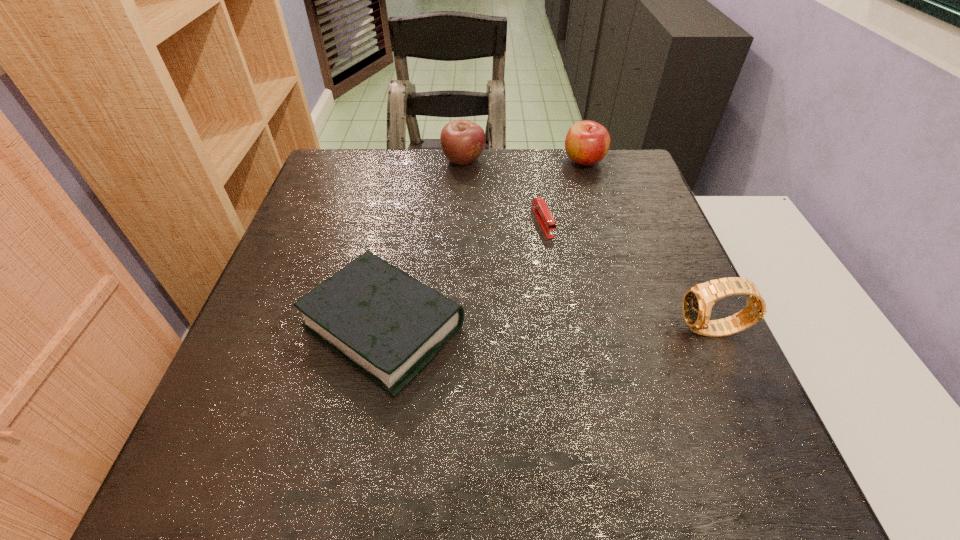
The width and height of the screenshot is (960, 540). I want to click on the third closest object to the fourth tallest object, so click(698, 300).

Choose which object is the nearest neighbor to the fourth tallest object. Please provide its 2D coordinates. Your answer should be formatted as a tuple, i.e. [(x, y)], where the tuple contains the x and y coordinates of a point satisfying the conditions above.

[(541, 211)]

Where is `free space in the image that satisfies the following two spatial constraints: 1. on the back side of the second object from right to left; 2. on the right side of the shortest object`? This screenshot has height=540, width=960. free space in the image that satisfies the following two spatial constraints: 1. on the back side of the second object from right to left; 2. on the right side of the shortest object is located at coordinates (533, 161).

I want to click on free space that satisfies the following two spatial constraints: 1. on the back side of the left apple; 2. on the right side of the second shortest object, so click(x=416, y=160).